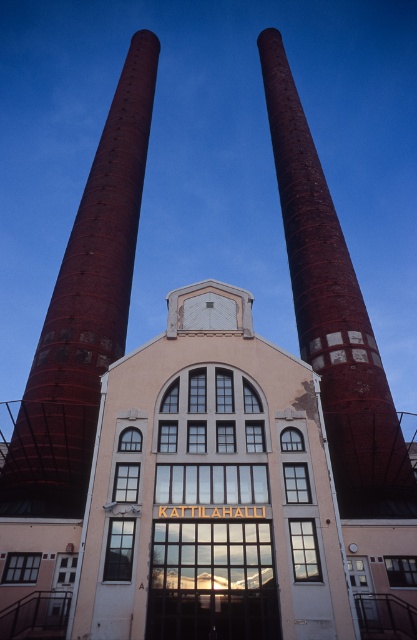
Between rusty brick chimney at center-left and rusty brick chimney at center, which one is positioned higher?

A: rusty brick chimney at center

Looking at this image, is rusty brick chimney at center-left below rusty brick chimney at center?

Yes, rusty brick chimney at center-left is below rusty brick chimney at center.

Measure the distance between point [22,490] and camera.

They are 42.99 meters apart.

Where is `rusty brick chimney at center-left`? The image size is (417, 640). rusty brick chimney at center-left is located at coordinates (85, 310).